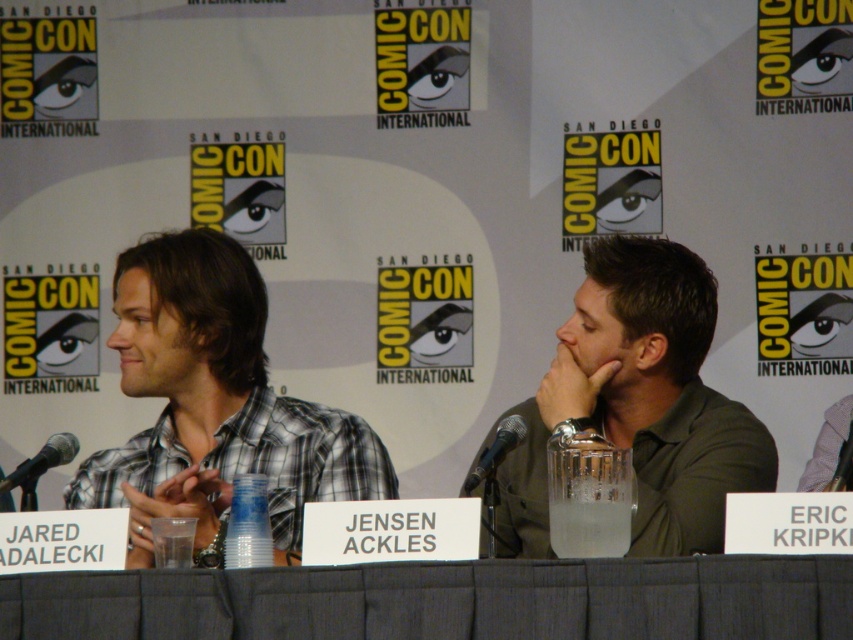
Question: Considering the relative positions of plaid shirt at center and black metallic microphone at left in the image provided, where is plaid shirt at center located with respect to black metallic microphone at left?

Choices:
 (A) left
 (B) right

Answer: (B)

Question: Among these points, which one is farthest from the camera?

Choices:
 (A) (26, 492)
 (B) (195, 497)
 (C) (509, 588)

Answer: (B)

Question: In this image, where is green matte shirt at center located relative to black metallic microphone at left?

Choices:
 (A) right
 (B) left

Answer: (A)

Question: Which point is farther from the camera taking this photo?

Choices:
 (A) (749, 566)
 (B) (329, 461)
 (C) (15, 483)

Answer: (B)

Question: Does plaid shirt at center have a larger size compared to black metallic microphone at left?

Choices:
 (A) yes
 (B) no

Answer: (A)

Question: Among these points, which one is nearest to the camera?

Choices:
 (A) (22, 470)
 (B) (474, 483)

Answer: (B)